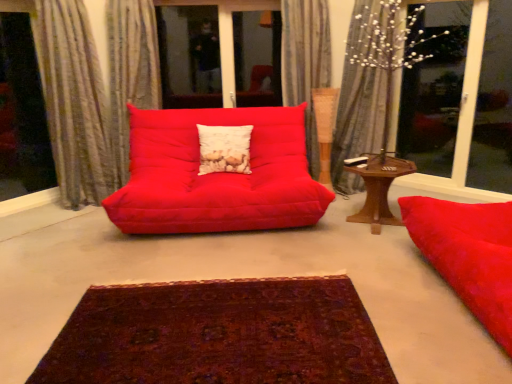
Question: From the image's perspective, is wooden hexagonal table at right above or below deep burgundy woven rug at center?

Choices:
 (A) below
 (B) above

Answer: (B)

Question: Is wooden hexagonal table at right wider or thinner than deep burgundy woven rug at center?

Choices:
 (A) wide
 (B) thin

Answer: (B)

Question: Which object is positioned closest to the silky gray curtain at upper center, which ranks as the fourth curtain in left-to-right order?

Choices:
 (A) textured grey curtain at left, which is counted as the first curtain, starting from the left
 (B) deep burgundy woven rug at center
 (C) transparent glass window at upper right
 (D) wooden hexagonal table at right
 (E) textured beige curtain at upper center, the second curtain in the right-to-left sequence

Answer: (E)

Question: Based on their relative distances, which object is farther from the transparent glass window at upper right?

Choices:
 (A) deep burgundy woven rug at center
 (B) textured beige curtain at left, the second curtain from the left
 (C) transparent glass window screen at left
 (D) textured grey curtain at left, which is counted as the first curtain, starting from the left
 (E) white textured pillow at center

Answer: (C)